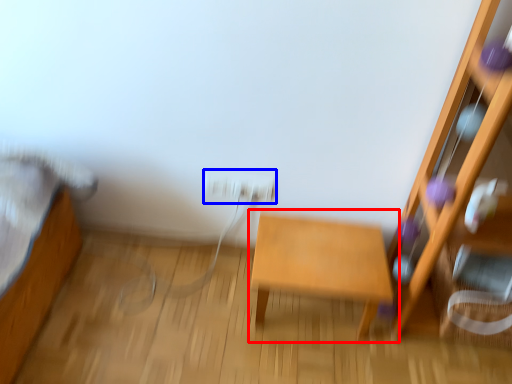
Question: Which object is further to the camera taking this photo, table (highlighted by a red box) or electric outlet (highlighted by a blue box)?

Choices:
 (A) table
 (B) electric outlet

Answer: (B)